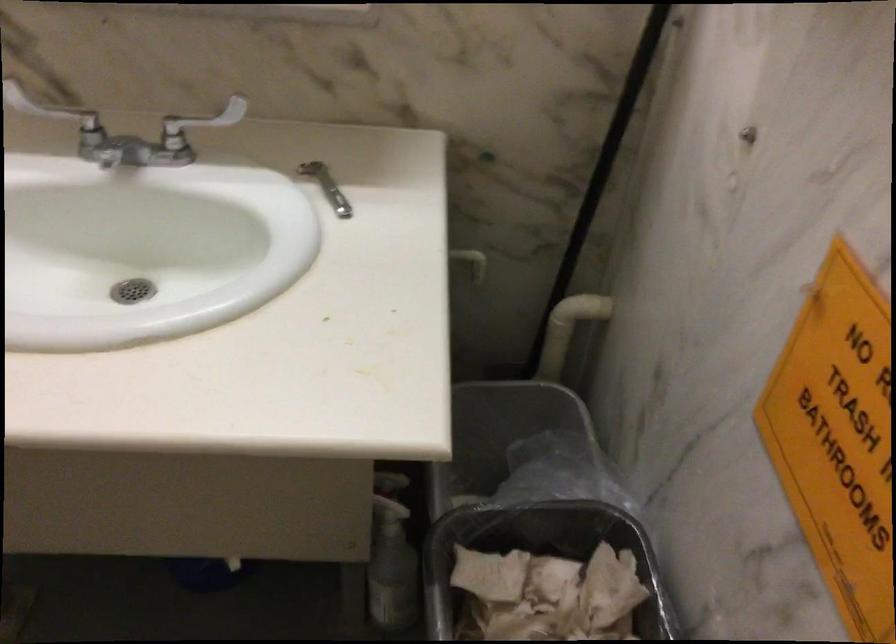
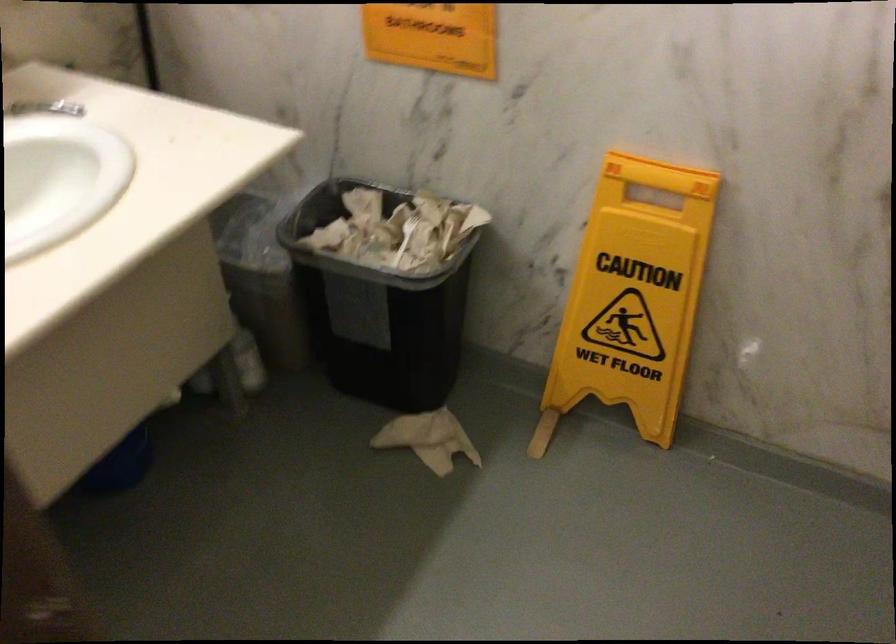
In the second image, find the point that corresponds to point (323, 178) in the first image.

(45, 108)